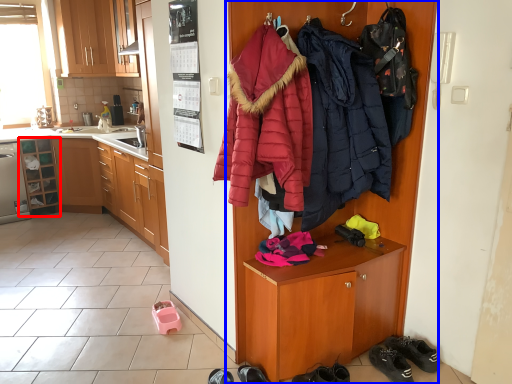
Question: Among these objects, which one is nearest to the camera, cabinetry (highlighted by a red box) or cupboard (highlighted by a blue box)?

Choices:
 (A) cabinetry
 (B) cupboard

Answer: (B)